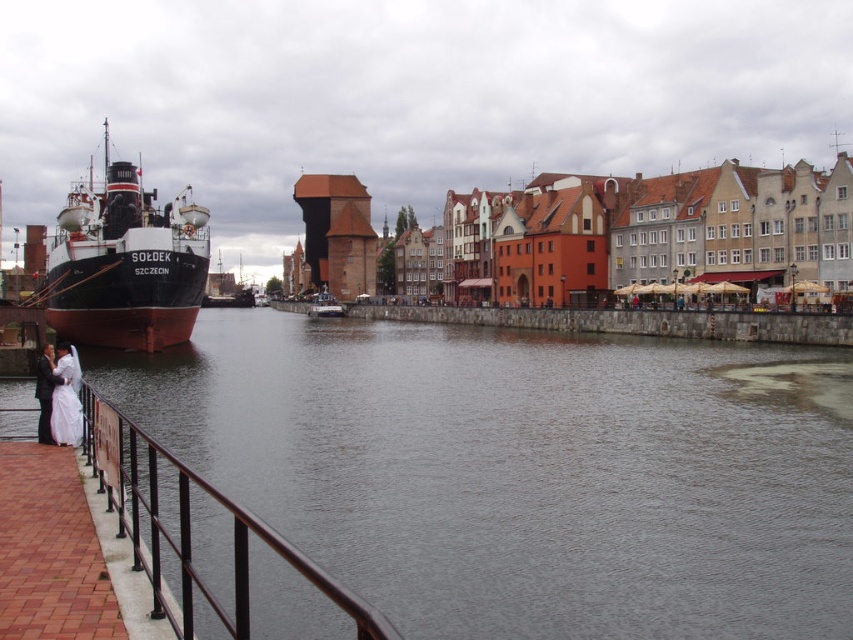
Question: Is black metal railing at lower left behind white satin dress at lower left?

Choices:
 (A) yes
 (B) no

Answer: (B)

Question: Estimate the real-world distances between objects in this image. Which object is closer to the metallic gray boat at center?

Choices:
 (A) black metal railing at lower left
 (B) white satin dress at lower left
 (C) matte black ship at left

Answer: (C)

Question: Which of the following is the farthest from the observer?

Choices:
 (A) metallic gray boat at center
 (B) black metal railing at lower left

Answer: (A)

Question: Does dark gray water at lower center appear over metallic gray boat at center?

Choices:
 (A) no
 (B) yes

Answer: (A)

Question: Among these objects, which one is farthest from the camera?

Choices:
 (A) metallic gray boat at center
 (B) white satin dress at lower left

Answer: (A)

Question: Considering the relative positions of matte black ship at left and white satin dress at lower left in the image provided, where is matte black ship at left located with respect to white satin dress at lower left?

Choices:
 (A) left
 (B) right

Answer: (A)